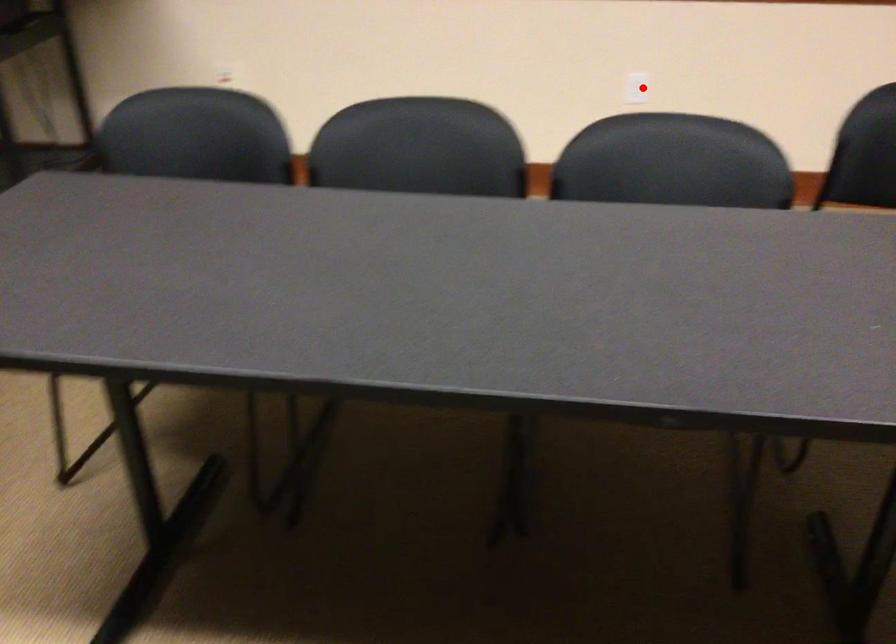
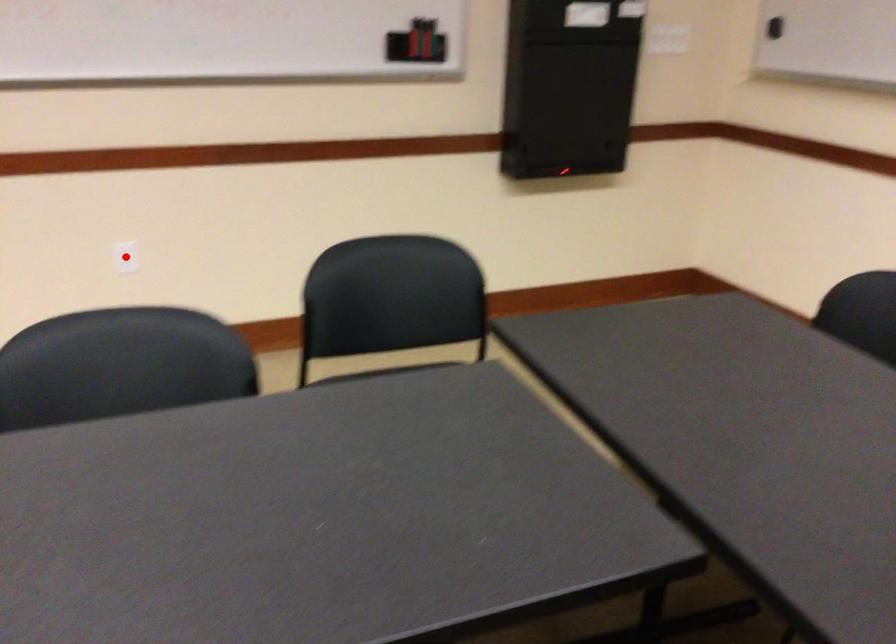
I am providing you with two images of the same scene from different viewpoints. A red point is marked on the first image and another point is marked on the second image. Do the highlighted points in image1 and image2 indicate the same real-world spot?

Yes